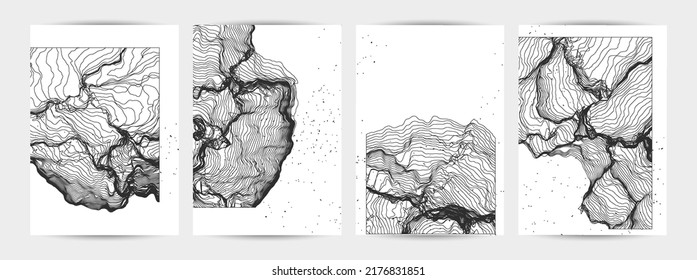
Where is `space between pictures`? The width and height of the screenshot is (697, 280). space between pictures is located at coordinates (507, 139), (348, 121), (183, 111).